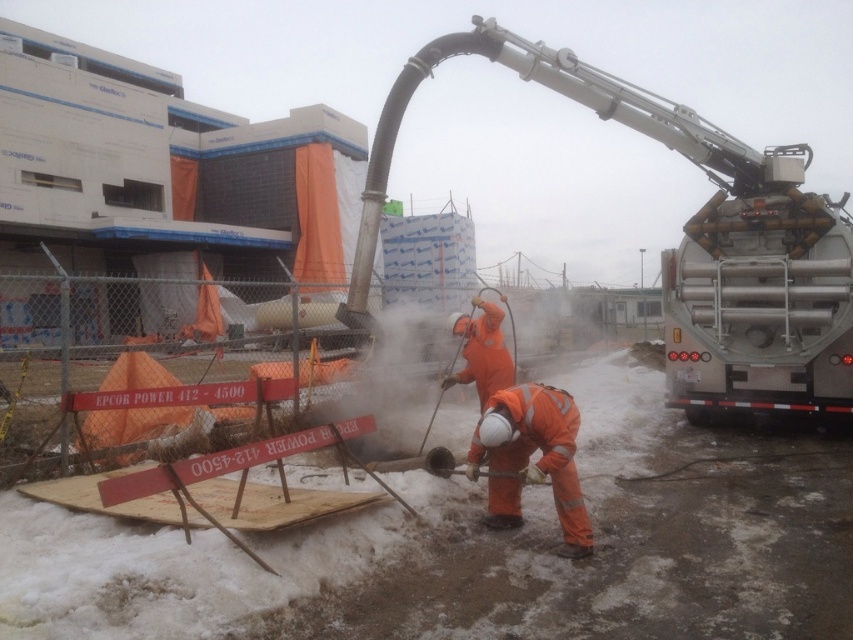
Between silver metallic truck at right and orange reflective workwear at lower center, which one appears on the left side from the viewer's perspective?

orange reflective workwear at lower center is more to the left.

Is silver metallic truck at right further to camera compared to orange reflective workwear at lower center?

Yes, silver metallic truck at right is further from the viewer.

What do you see at coordinates (689, 241) in the screenshot? The image size is (853, 640). I see `silver metallic truck at right` at bounding box center [689, 241].

Identify the location of silver metallic truck at right. (689, 241).